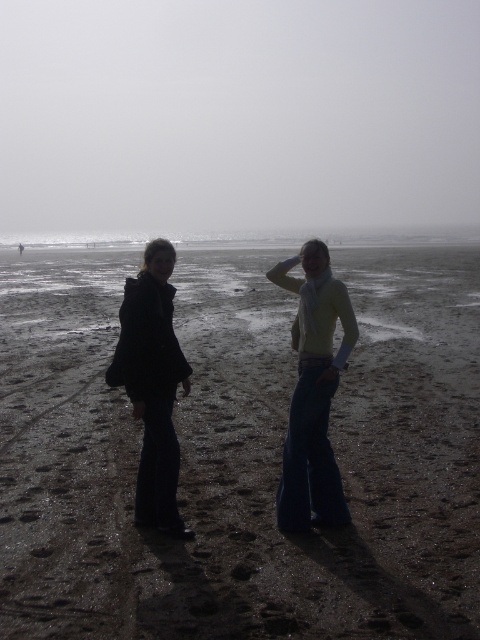
Question: Which object is farther from the camera taking this photo?

Choices:
 (A) light yellow sweater at center
 (B) matte black coat at left
 (C) dark sand at center
 (D) dark blue jeans at center

Answer: (D)

Question: Does dark sand at center have a larger size compared to light yellow sweater at center?

Choices:
 (A) yes
 (B) no

Answer: (A)

Question: Considering the real-world distances, which object is closest to the dark blue jeans at center?

Choices:
 (A) dark sand at center
 (B) matte black coat at left

Answer: (B)

Question: Which point is farther to the camera?

Choices:
 (A) (250, 426)
 (B) (309, 481)

Answer: (A)

Question: From the image, what is the correct spatial relationship of dark sand at center in relation to matte black coat at left?

Choices:
 (A) right
 (B) left

Answer: (A)

Question: Is light yellow sweater at center smaller than matte black coat at left?

Choices:
 (A) no
 (B) yes

Answer: (A)